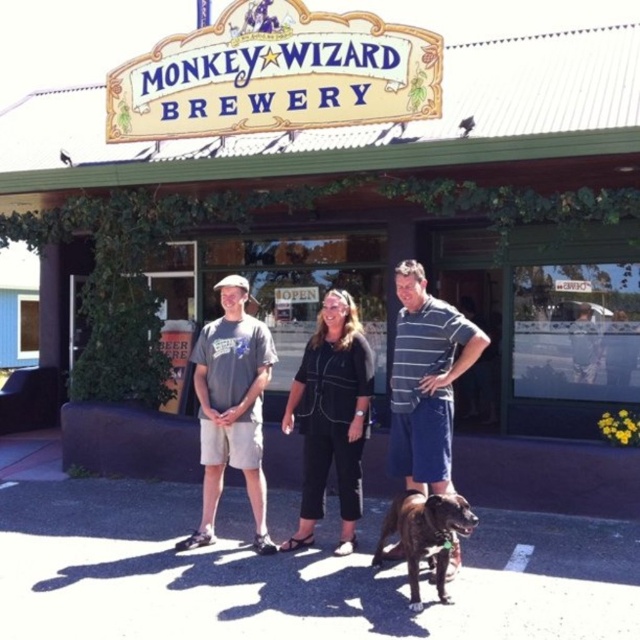
Question: Which of the following is the farthest from the observer?

Choices:
 (A) black cotton pants at center
 (B) striped cotton shirt at center
 (C) gray cotton t-shirt at center

Answer: (C)

Question: Does dark gray cotton shirt at center have a lesser width compared to brown brindle dog at center?

Choices:
 (A) yes
 (B) no

Answer: (B)

Question: Does dark gray cotton shirt at center come in front of striped cotton shirt at center?

Choices:
 (A) yes
 (B) no

Answer: (B)

Question: Does dark gray cotton shirt at center have a larger size compared to brown brindle dog at center?

Choices:
 (A) no
 (B) yes

Answer: (B)

Question: Which point is farther to the camera?

Choices:
 (A) (346, 416)
 (B) (464, 340)
 (C) (218, 381)
 (D) (321, 506)

Answer: (D)

Question: Which point is farther to the camera?

Choices:
 (A) (458, 376)
 (B) (448, 456)
 (C) (333, 384)

Answer: (C)